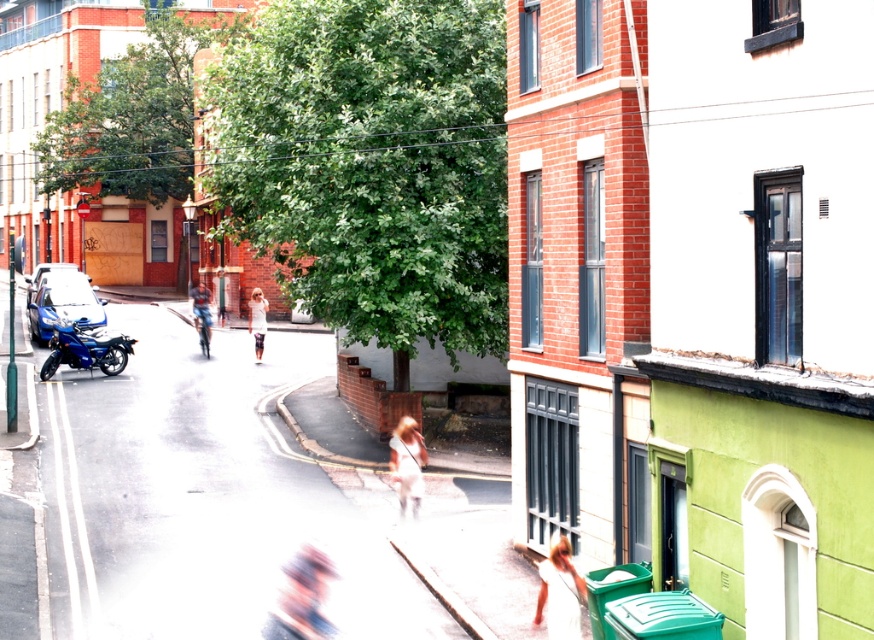
Is point (323, 624) closer to camera compared to point (573, 637)?

Yes.

The width and height of the screenshot is (874, 640). Describe the element at coordinates (302, 596) in the screenshot. I see `blurred fabric headscarf at center` at that location.

Where is `blurred fabric headscarf at center`? This screenshot has height=640, width=874. blurred fabric headscarf at center is located at coordinates (302, 596).

Measure the distance from blurred fabric headscarf at center to light beige pants at center.

blurred fabric headscarf at center and light beige pants at center are 67.70 feet apart from each other.

What are the coordinates of `blurred fabric headscarf at center` in the screenshot? It's located at (302, 596).

Does white cotton dress at lower right appear on the left side of shiny blue motorcycle at left?

In fact, white cotton dress at lower right is to the right of shiny blue motorcycle at left.

This screenshot has width=874, height=640. Identify the location of white cotton dress at lower right. (559, 593).